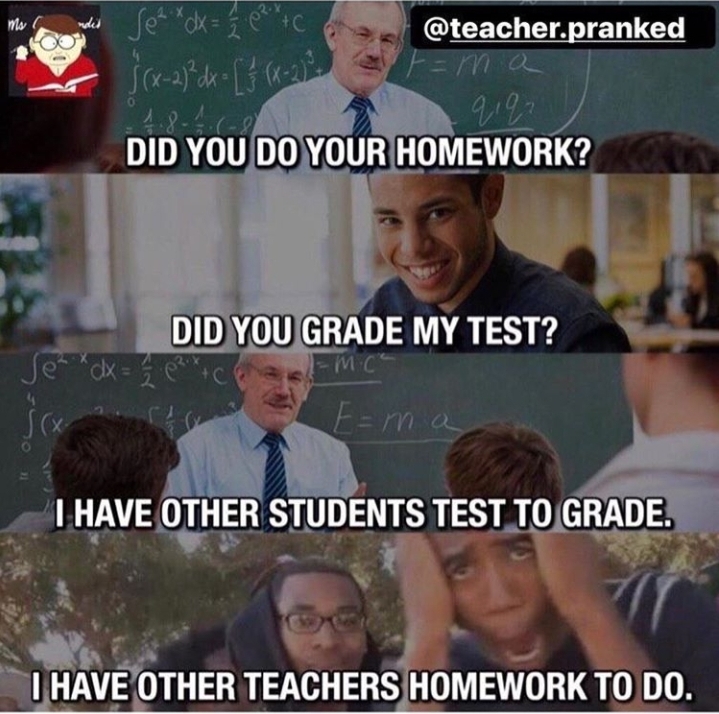
This screenshot has width=719, height=714. Identify the location of book. (82, 83).